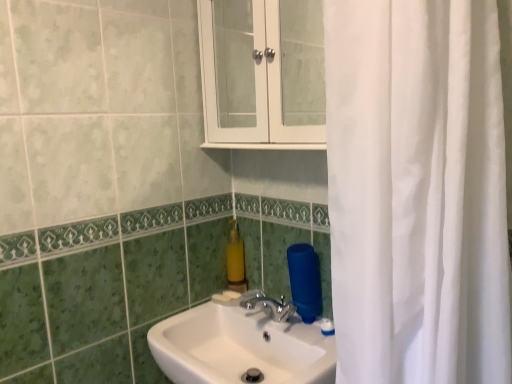
Question: Should I look upward or downward to see white glossy cabinet at upper center?

Choices:
 (A) down
 (B) up

Answer: (B)

Question: Considering the relative sizes of white glossy cabinet at upper center and yellow matte soap dispenser at center in the image provided, is white glossy cabinet at upper center shorter than yellow matte soap dispenser at center?

Choices:
 (A) yes
 (B) no

Answer: (B)

Question: Is white glossy cabinet at upper center not near yellow matte soap dispenser at center?

Choices:
 (A) no
 (B) yes

Answer: (A)

Question: Is white glossy cabinet at upper center closer to the viewer compared to yellow matte soap dispenser at center?

Choices:
 (A) yes
 (B) no

Answer: (A)

Question: From the image's perspective, is white glossy cabinet at upper center located above yellow matte soap dispenser at center?

Choices:
 (A) no
 (B) yes

Answer: (B)

Question: Does white glossy cabinet at upper center have a greater height compared to yellow matte soap dispenser at center?

Choices:
 (A) no
 (B) yes

Answer: (B)

Question: Is white glossy cabinet at upper center further to camera compared to yellow matte soap dispenser at center?

Choices:
 (A) yes
 (B) no

Answer: (B)

Question: From the image's perspective, does white glossy cabinet at upper center appear higher than white glossy sink at center?

Choices:
 (A) no
 (B) yes

Answer: (B)

Question: Is white glossy cabinet at upper center bigger than white glossy sink at center?

Choices:
 (A) yes
 (B) no

Answer: (B)

Question: Is white glossy cabinet at upper center beside white glossy sink at center?

Choices:
 (A) yes
 (B) no

Answer: (B)

Question: Is the position of white glossy cabinet at upper center less distant than that of white glossy sink at center?

Choices:
 (A) no
 (B) yes

Answer: (A)

Question: Would you say white glossy sink at center is part of white glossy cabinet at upper center's contents?

Choices:
 (A) yes
 (B) no

Answer: (B)

Question: Does white glossy cabinet at upper center have a greater height compared to white glossy sink at center?

Choices:
 (A) yes
 (B) no

Answer: (A)

Question: Considering the relative sizes of white glossy sink at center and yellow matte soap dispenser at center in the image provided, is white glossy sink at center smaller than yellow matte soap dispenser at center?

Choices:
 (A) yes
 (B) no

Answer: (B)